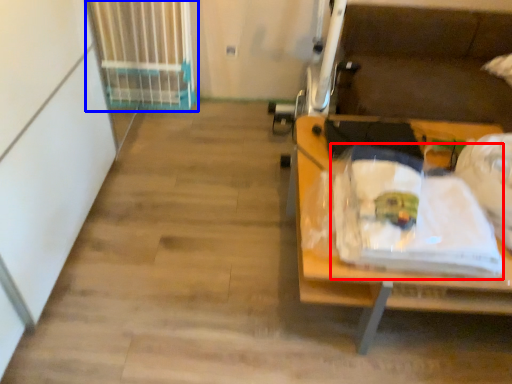
Question: Which point is further to the camera, waste (highlighted by a red box) or radiator (highlighted by a blue box)?

Choices:
 (A) waste
 (B) radiator

Answer: (B)